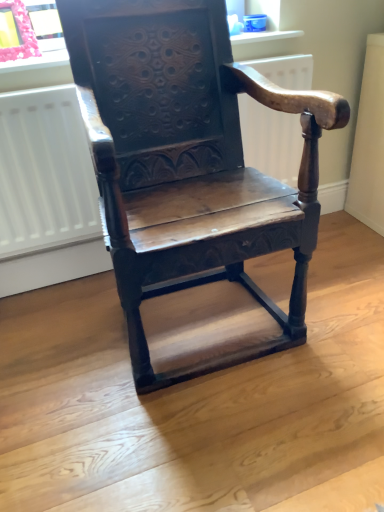
Locate an element on the screen. Image resolution: width=384 pixels, height=512 pixels. free space on the front side of white matte radiator at center is located at coordinates (165, 407).